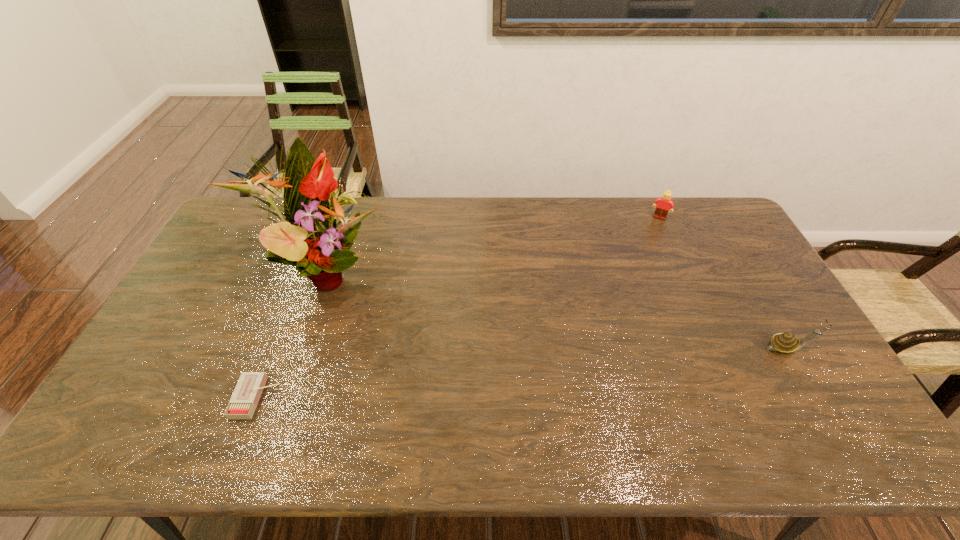
The width and height of the screenshot is (960, 540). Identify the location of free space at the left edge of the desktop. (179, 316).

Where is `vacant space at the right edge of the desktop`? vacant space at the right edge of the desktop is located at coordinates (765, 354).

In the image, there is a desktop. Where is `vacant space at the far left corner`? Image resolution: width=960 pixels, height=540 pixels. vacant space at the far left corner is located at coordinates (252, 211).

The height and width of the screenshot is (540, 960). In the image, there is a desktop. Find the location of `vacant space at the near left corner`. vacant space at the near left corner is located at coordinates (177, 394).

The image size is (960, 540). I want to click on vacant area that lies between the farthest object and the shortest object, so click(458, 308).

Identify the location of free spot between the third farthest object and the matchbox. (522, 373).

Identify the location of free space between the matchbox and the second object from right to left. This screenshot has width=960, height=540. click(458, 308).

The height and width of the screenshot is (540, 960). In order to click on free space between the tallest object and the snail in this screenshot , I will do `click(557, 310)`.

In order to click on free space between the shortest object and the third object from left to right in this screenshot , I will do `click(458, 308)`.

What are the coordinates of `vacant point located between the Lego and the matchbox` in the screenshot? It's located at (458, 308).